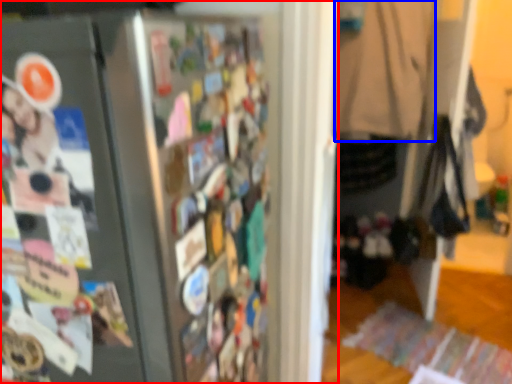
Question: Which object appears closest to the camera in this image, refrigerator (highlighted by a red box) or clothing (highlighted by a blue box)?

Choices:
 (A) refrigerator
 (B) clothing

Answer: (A)